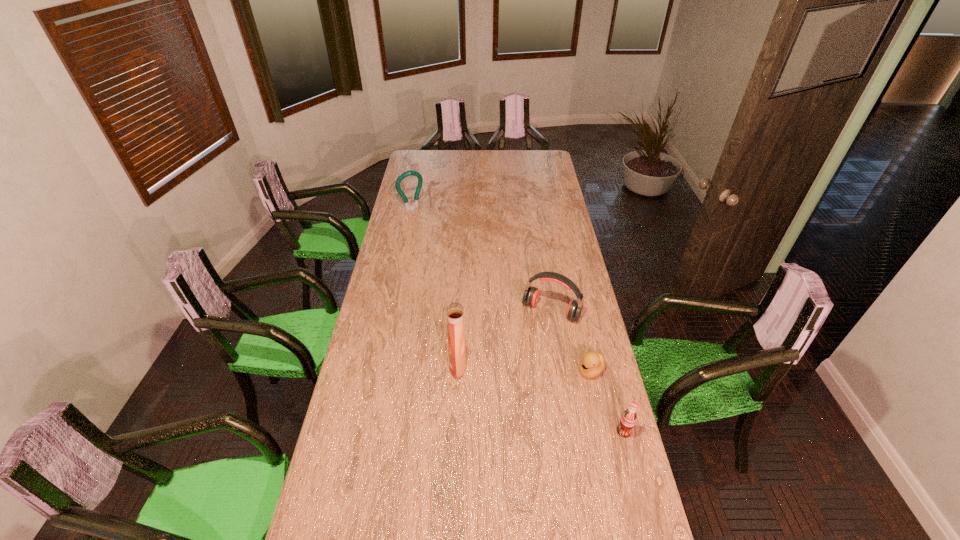
The width and height of the screenshot is (960, 540). In order to click on detergent in this screenshot , I will do `click(455, 312)`.

This screenshot has height=540, width=960. I want to click on the second object from left to right, so click(x=455, y=312).

This screenshot has height=540, width=960. Find the location of `the second shortest object`. the second shortest object is located at coordinates (628, 419).

Find the location of `soda`. soda is located at coordinates (628, 419).

At what (x,y) coordinates should I click in order to perform the action: click on earphone. Please return your answer as a coordinate pair (x, y). Looking at the image, I should click on (531, 295).

At what (x,y) coordinates should I click in order to perform the action: click on the second farthest object. Please return your answer as a coordinate pair (x, y). Looking at the image, I should click on (531, 295).

This screenshot has height=540, width=960. I want to click on the shortest object, so click(593, 363).

Where is `the second tallest object`? the second tallest object is located at coordinates [x=420, y=180].

Image resolution: width=960 pixels, height=540 pixels. What are the coordinates of `the leftmost object` in the screenshot? It's located at (420, 180).

I want to click on vacant space situated 0.270m on the front-facing side of the fourth object from right to left, so click(x=376, y=364).